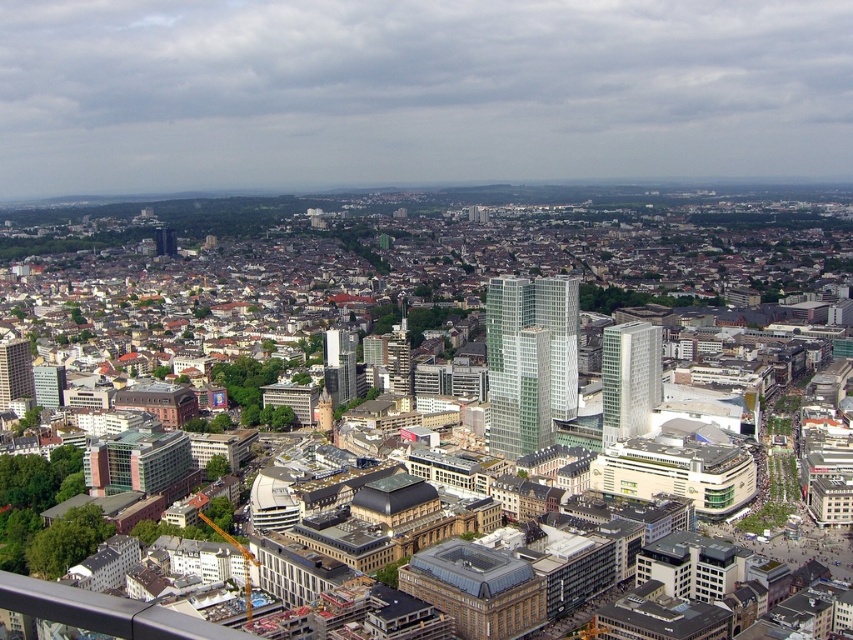
You are a drone operator tasked with capturing aerial footage of the city. You need to fly your drone between the white glass skyscraper at center and the glassy skyscraper at center. Which skyscraper should you fly under to ensure the drone stays above the other?

The white glass skyscraper at center is located below the glassy skyscraper at center, so to stay above the other, you should fly under the glassy skyscraper at center.